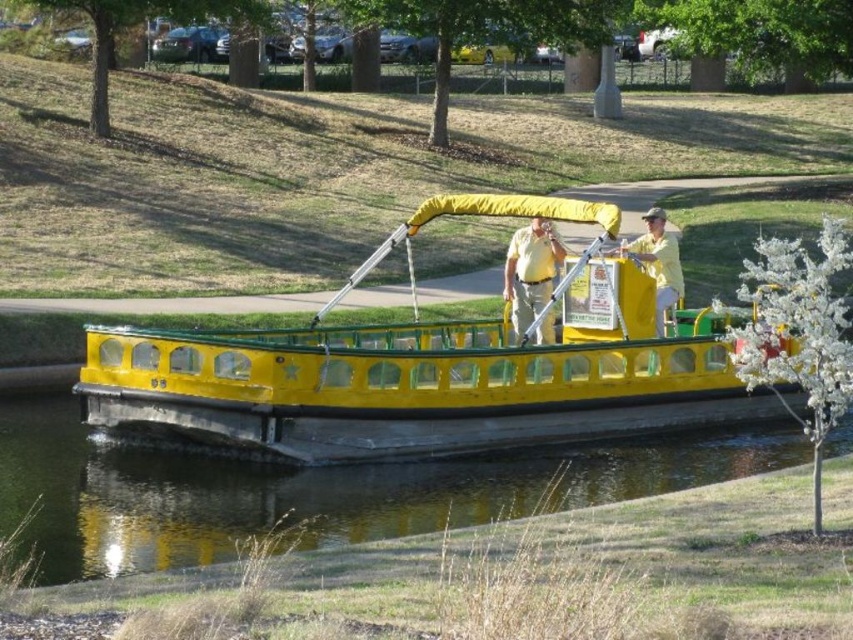
You are standing on the dock and want to board the yellow matte boat at center. According to the coordinates provided, is the boat positioned closer to the dock or further away from it?

The yellow matte boat at center is located at point (425,380), which indicates its position relative to the dock. Since the coordinates are specific but no reference points are given for the dock, it is impossible to determine if the boat is closer or further away without additional information about the coordinate system used.

You are a photographer trying to capture a photo of the yellow rubber boat at center and the yellow matte shirt at center from the left side of the boat. Which object should you focus on first to ensure both are in the frame?

The yellow rubber boat at center is to the left of the yellow matte shirt at center, so you should focus on the yellow rubber boat at center first to ensure both are in the frame.

Looking at this image, you are a photographer trying to capture a photo of the yellow rubber boat at center and the yellow matte shirt at center. Since you want to focus on the boat, which object should you zoom in on more, considering their sizes?

The yellow rubber boat at center is larger than the yellow matte shirt at center, so you should zoom in more on the yellow rubber boat at center to focus on it.